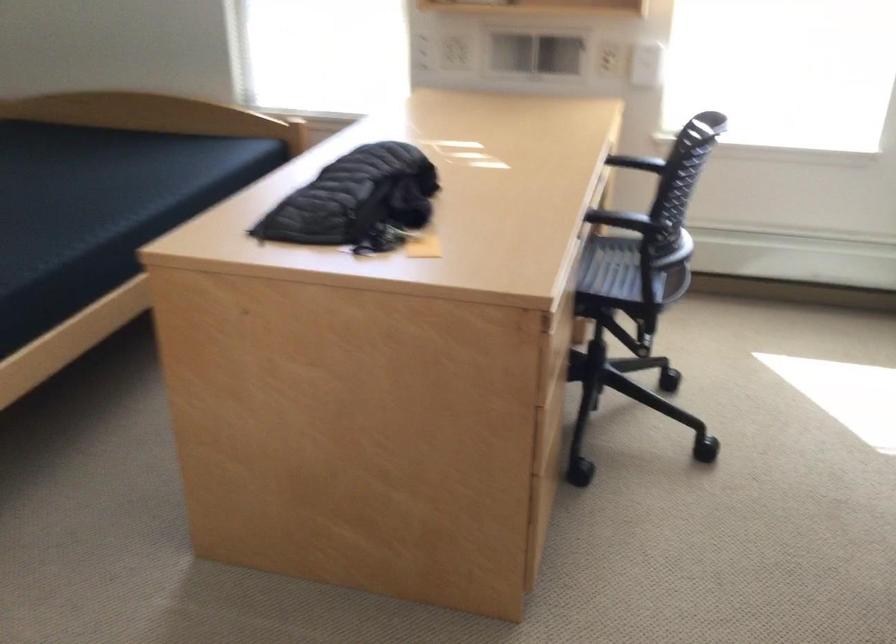
Find where to sit the chair sitting surface. Please return your answer as a coordinate pair (x, y).

(616, 275)